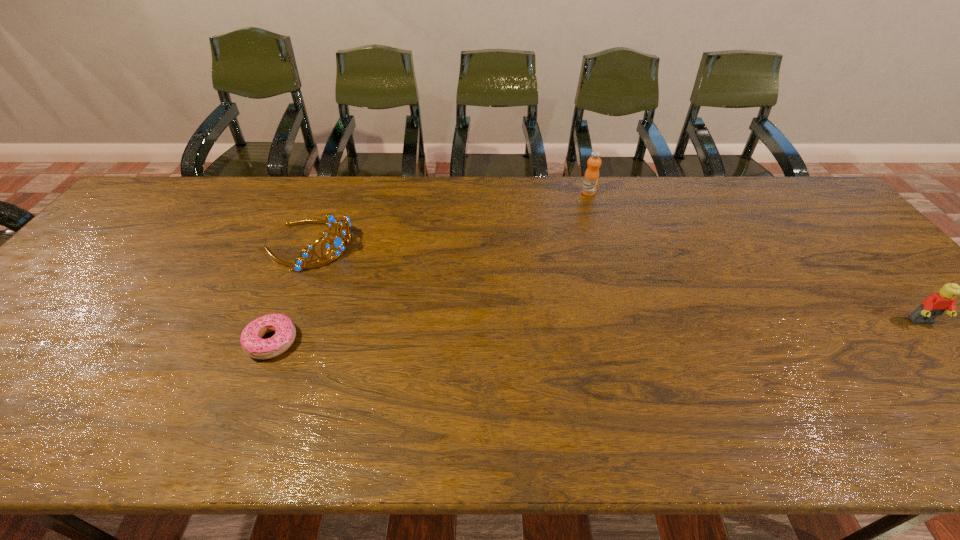
Where is `the shortest object`? The image size is (960, 540). the shortest object is located at coordinates (253, 345).

What are the coordinates of `the rightmost object` in the screenshot? It's located at (934, 305).

Find the location of a particular element. Image resolution: width=960 pixels, height=540 pixels. Lego is located at coordinates (934, 305).

Where is `the third nearest object`? The height and width of the screenshot is (540, 960). the third nearest object is located at coordinates (330, 220).

Where is `the second object from right to left`? The width and height of the screenshot is (960, 540). the second object from right to left is located at coordinates (591, 177).

This screenshot has width=960, height=540. In order to click on orange juice in this screenshot , I will do `click(591, 177)`.

The width and height of the screenshot is (960, 540). I want to click on free spot located 0.290m on the back of the doughnut, so click(312, 244).

In order to click on free spot located 0.050m on the face of the third tallest object in this screenshot , I will do pyautogui.click(x=944, y=346).

Where is `vacant point located on the front-facing side of the tiara`? The width and height of the screenshot is (960, 540). vacant point located on the front-facing side of the tiara is located at coordinates (385, 276).

Locate an element on the screen. The height and width of the screenshot is (540, 960). vacant region located 0.390m on the front-facing side of the tiara is located at coordinates (463, 308).